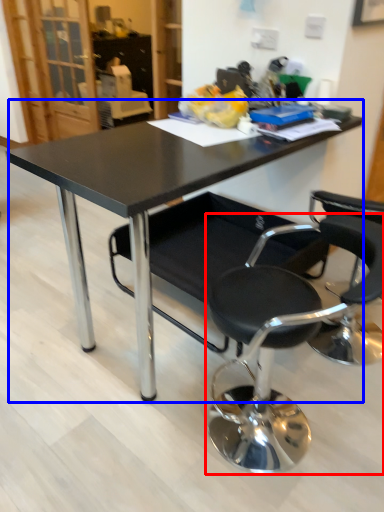
Question: Which point is closer to the camera, chair (highlighted by a red box) or table (highlighted by a blue box)?

Choices:
 (A) chair
 (B) table

Answer: (A)